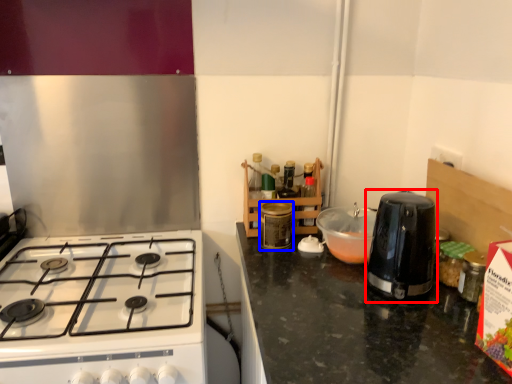
Question: Which point is closer to the camera, kitchen appliance (highlighted by a red box) or kitchen appliance (highlighted by a blue box)?

Choices:
 (A) kitchen appliance
 (B) kitchen appliance

Answer: (A)